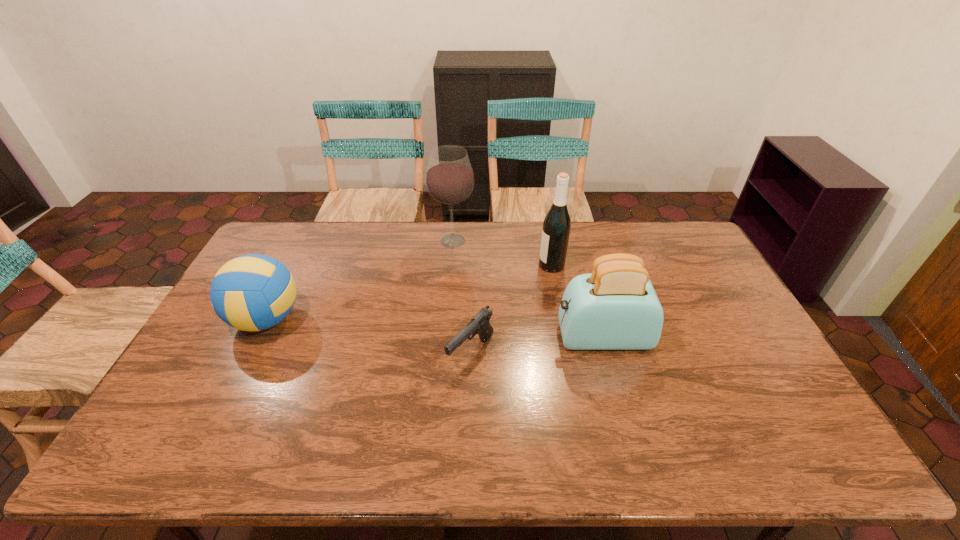
Identify the location of alcohol. This screenshot has width=960, height=540. (449, 179).

Locate an element on the screen. This screenshot has width=960, height=540. wine bottle is located at coordinates (556, 226).

In order to click on the third tallest object in this screenshot , I will do `click(615, 307)`.

Where is `volleyball`? Image resolution: width=960 pixels, height=540 pixels. volleyball is located at coordinates (254, 292).

Where is `the fourth tallest object`? the fourth tallest object is located at coordinates (254, 292).

The width and height of the screenshot is (960, 540). I want to click on gun, so 479,324.

I want to click on free space located on the right of the alcohol, so click(556, 241).

In order to click on vacant space located 0.150m on the label of the fourth nearest object in this screenshot , I will do `click(495, 265)`.

Find the location of a particular element. free region located on the label of the fourth nearest object is located at coordinates (452, 265).

Locate an element on the screen. This screenshot has width=960, height=540. free space located 0.340m on the label of the fourth nearest object is located at coordinates (442, 265).